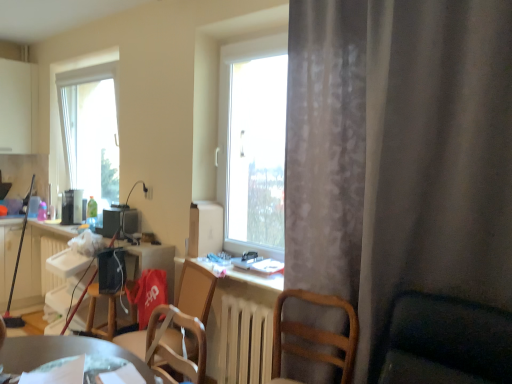
Question: Would you say transparent glass window at left is inside or outside matte black computer desk at left?

Choices:
 (A) outside
 (B) inside

Answer: (A)

Question: Considering the positions of point (74, 66) and point (77, 324), is point (74, 66) closer or farther from the camera than point (77, 324)?

Choices:
 (A) farther
 (B) closer

Answer: (A)

Question: Estimate the real-world distances between objects in this image. Which object is closer to the wooden chair at center, arranged as the 3th chair when viewed from the right?

Choices:
 (A) white plastic radiator at left, placed as the 2th radiator when sorted from right to left
 (B) wooden chair at lower center, which is the 2th chair in left-to-right order
 (C) green glass bottle at center
 (D) metallic silver desk at lower center
 (E) matte black coffee maker at left, which appears as the third appliance when viewed from the right

Answer: (B)

Question: Which is farther from the white matte radiator at center, positioned as the 2th radiator in left-to-right order?

Choices:
 (A) wooden chair at center, arranged as the 3th chair when viewed from the right
 (B) matte black computer desk at left
 (C) white cardboard box at center, the first appliance positioned from the front
 (D) white plastic radiator at left, the first radiator when ordered from back to front
 (E) gray sheer curtain at right

Answer: (D)